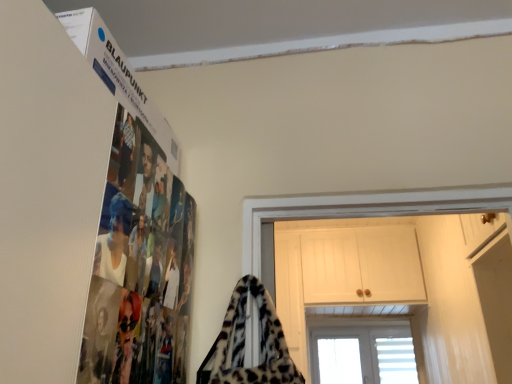
Question: Is point (430, 306) closer or farther from the camera than point (225, 372)?

Choices:
 (A) farther
 (B) closer

Answer: (A)

Question: Is white wood cabinet at upper center bigger or smaller than leopard print fur at center?

Choices:
 (A) big
 (B) small

Answer: (A)

Question: From the image's perspective, relative to leopard print fur at center, is white wood cabinet at upper center above or below?

Choices:
 (A) below
 (B) above

Answer: (A)

Question: Is leopard print fur at center spatially inside white wood cabinet at upper center, or outside of it?

Choices:
 (A) inside
 (B) outside

Answer: (B)

Question: From their relative heights in the image, would you say leopard print fur at center is taller or shorter than white wood cabinet at upper center?

Choices:
 (A) short
 (B) tall

Answer: (A)

Question: From the image's perspective, is leopard print fur at center located above or below white wood cabinet at upper center?

Choices:
 (A) above
 (B) below

Answer: (A)

Question: Does point (264, 301) appear closer or farther from the camera than point (453, 296)?

Choices:
 (A) farther
 (B) closer

Answer: (B)